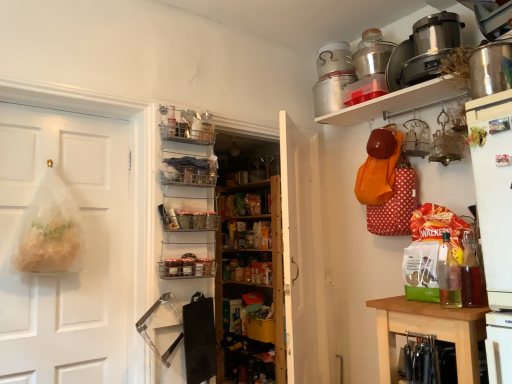
Locate an element on the screen. The image size is (512, 384). free space behind clear glass bottle at lower right, the 1th bottle in the left-to-right sequence is located at coordinates (430, 306).